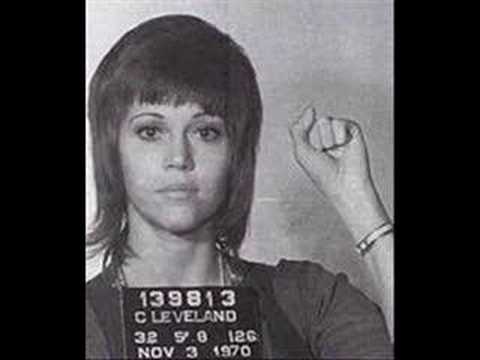
Locate an element on the screen. wall is located at coordinates tap(286, 221).